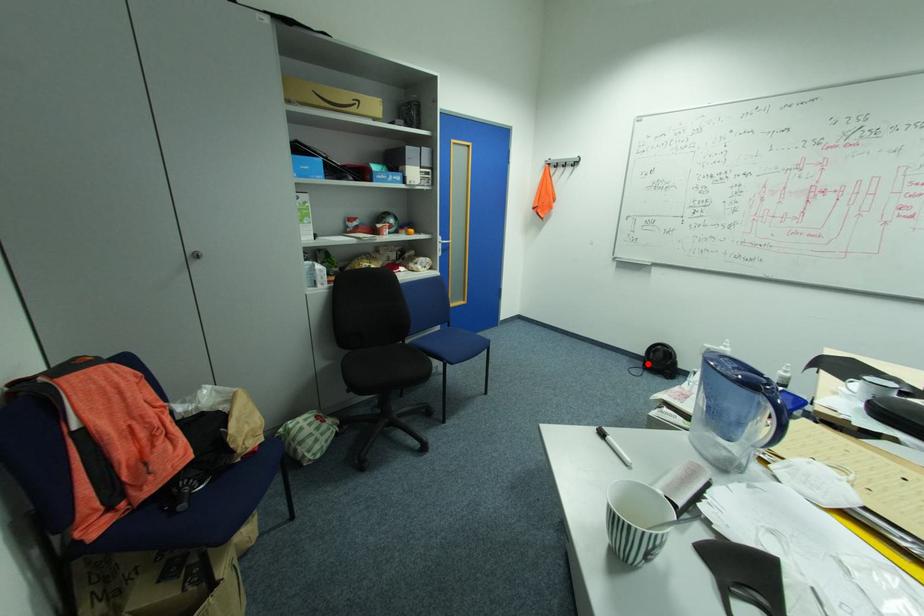
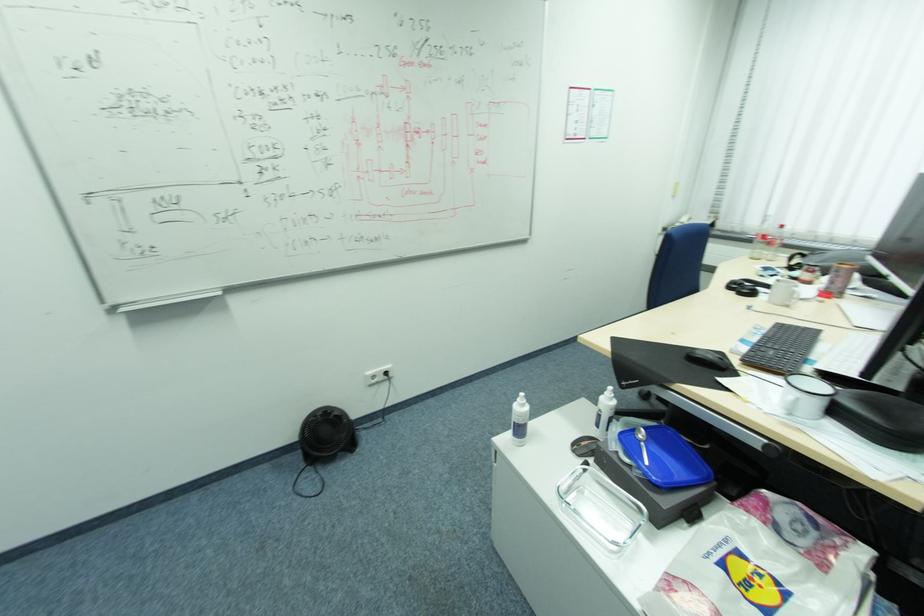
Where in the second image is the point corresponding to the highlighted location from the first image?

(304, 456)